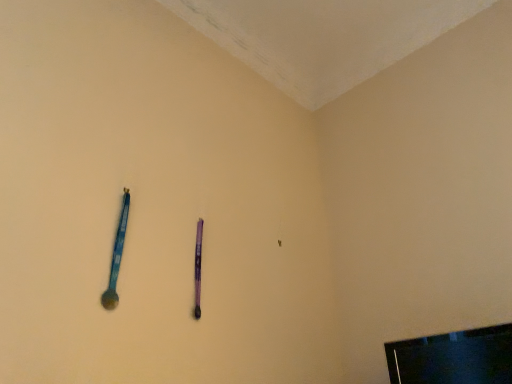
Question: Should I look upward or downward to see purple matte pen at center?

Choices:
 (A) down
 (B) up

Answer: (A)

Question: Does blue plastic spoon at left appear on the left side of purple matte pen at center?

Choices:
 (A) no
 (B) yes

Answer: (B)

Question: From a real-world perspective, is blue plastic spoon at left located higher than purple matte pen at center?

Choices:
 (A) yes
 (B) no

Answer: (A)

Question: Considering the relative sizes of blue plastic spoon at left and purple matte pen at center in the image provided, is blue plastic spoon at left bigger than purple matte pen at center?

Choices:
 (A) no
 (B) yes

Answer: (B)

Question: Does blue plastic spoon at left appear on the right side of purple matte pen at center?

Choices:
 (A) no
 (B) yes

Answer: (A)

Question: From the image's perspective, does blue plastic spoon at left appear lower than purple matte pen at center?

Choices:
 (A) no
 (B) yes

Answer: (A)

Question: Is purple matte pen at center located within blue plastic spoon at left?

Choices:
 (A) no
 (B) yes

Answer: (A)

Question: Is purple matte pen at center turned away from blue plastic spoon at left?

Choices:
 (A) no
 (B) yes

Answer: (A)

Question: Considering the relative sizes of purple matte pen at center and blue plastic spoon at left in the image provided, is purple matte pen at center taller than blue plastic spoon at left?

Choices:
 (A) no
 (B) yes

Answer: (A)

Question: Considering the relative sizes of purple matte pen at center and blue plastic spoon at left in the image provided, is purple matte pen at center smaller than blue plastic spoon at left?

Choices:
 (A) no
 (B) yes

Answer: (B)

Question: From a real-world perspective, is purple matte pen at center physically below blue plastic spoon at left?

Choices:
 (A) no
 (B) yes

Answer: (B)

Question: From a real-world perspective, is purple matte pen at center on blue plastic spoon at left?

Choices:
 (A) yes
 (B) no

Answer: (B)

Question: From the image's perspective, is purple matte pen at center on top of blue plastic spoon at left?

Choices:
 (A) no
 (B) yes

Answer: (A)

Question: From a real-world perspective, is black glossy television at lower right located beneath blue plastic spoon at left?

Choices:
 (A) yes
 (B) no

Answer: (A)